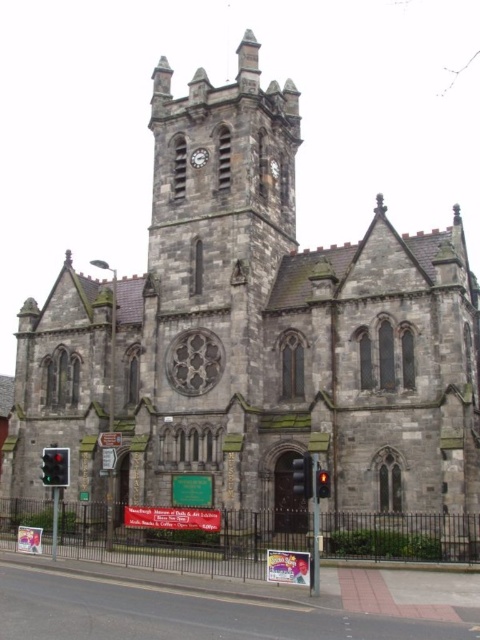
Question: Considering the relative positions of red glass traffic light at lower center and red glass traffic light at lower left in the image provided, where is red glass traffic light at lower center located with respect to red glass traffic light at lower left?

Choices:
 (A) above
 (B) below

Answer: (B)

Question: Which of these objects is positioned closest to the metallic traffic light at lower left?

Choices:
 (A) metallic clock face at upper center
 (B) metallic clock at upper center
 (C) red glass traffic light at center

Answer: (C)

Question: Among these points, which one is nearest to the camera?

Choices:
 (A) (307, 481)
 (B) (207, 154)
 (C) (276, 161)
 (D) (61, 464)

Answer: (A)

Question: Is red glass traffic light at lower left further to camera compared to metallic traffic light at lower left?

Choices:
 (A) yes
 (B) no

Answer: (A)

Question: Which point is closer to the camera taking this photo?

Choices:
 (A) (205, 156)
 (B) (327, 476)

Answer: (B)

Question: Is red glass traffic light at lower center closer to camera compared to metallic clock face at upper center?

Choices:
 (A) no
 (B) yes

Answer: (B)